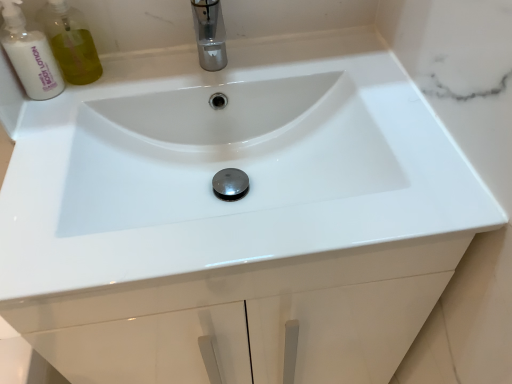
The image size is (512, 384). Identify the location of vacant space to the left of polished chrome tap at upper center. (120, 87).